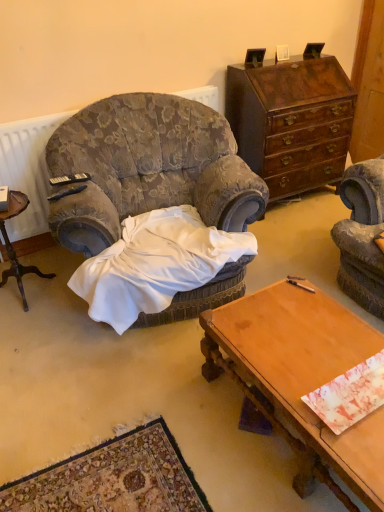
Where is `free point above wooden desk at lower right (from a real-world perspective)`? Image resolution: width=384 pixels, height=512 pixels. free point above wooden desk at lower right (from a real-world perspective) is located at coordinates (311, 353).